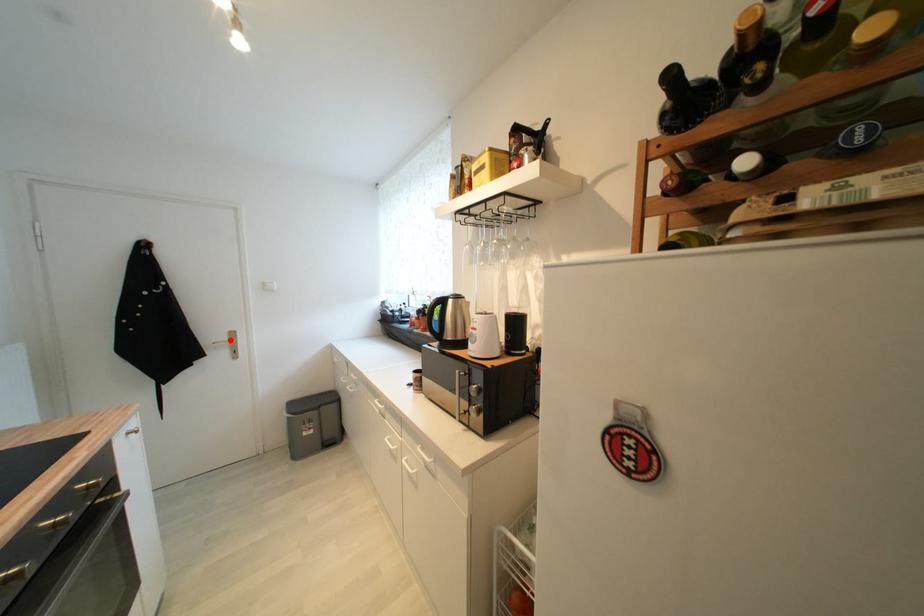
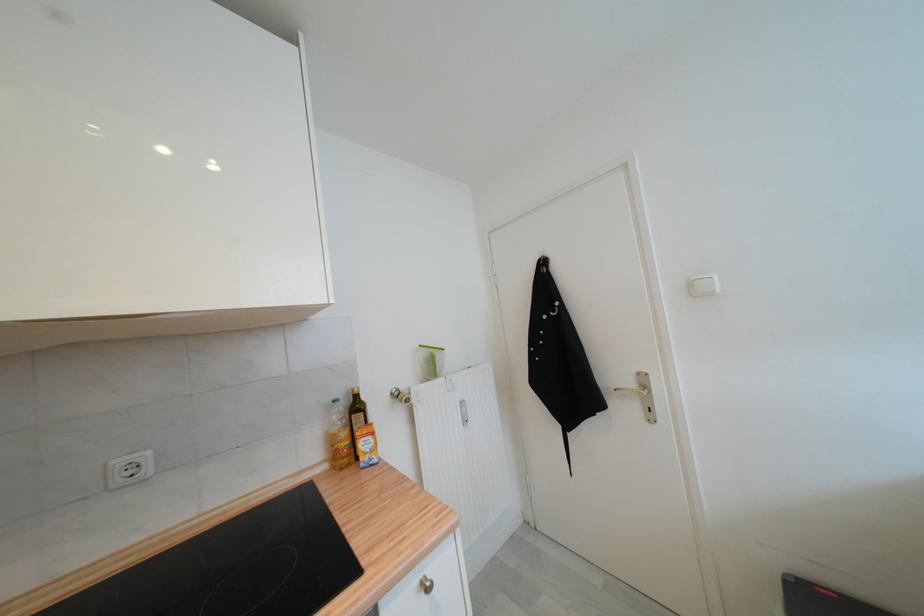
Where in the second image is the point corresponding to the highlighted location from the first image?

(637, 386)